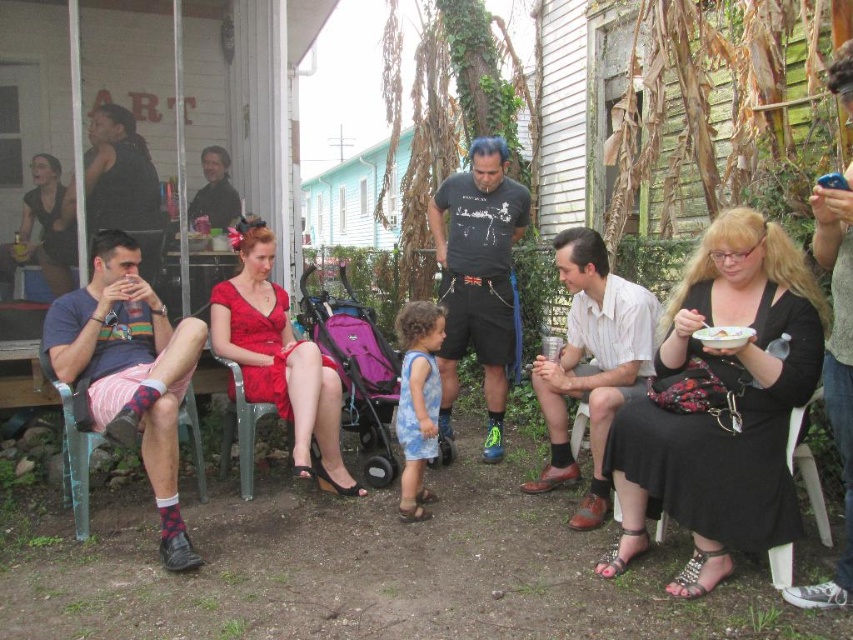
Question: Among these objects, which one is nearest to the camera?

Choices:
 (A) matte black t-shirt at center
 (B) white plastic chair at lower right
 (C) blue printed dress at center

Answer: (B)

Question: Is white striped shirt at center bigger than matte red dress at center?

Choices:
 (A) no
 (B) yes

Answer: (A)

Question: Does matte black t-shirt at center have a larger size compared to matte red dress at center?

Choices:
 (A) no
 (B) yes

Answer: (A)

Question: Can you confirm if metallic green chair at left is positioned above white plastic chair at lower right?

Choices:
 (A) no
 (B) yes

Answer: (B)

Question: Based on their relative distances, which object is nearer to the black satin dress at right?

Choices:
 (A) white plastic chair at lower right
 (B) white striped shirt at center
 (C) matte black t-shirt at center
 (D) matte red dress at center

Answer: (A)

Question: Which point appears farthest from the camera in this image?

Choices:
 (A) (593, 337)
 (B) (793, 378)
 (C) (656, 532)
 (D) (288, 410)

Answer: (D)